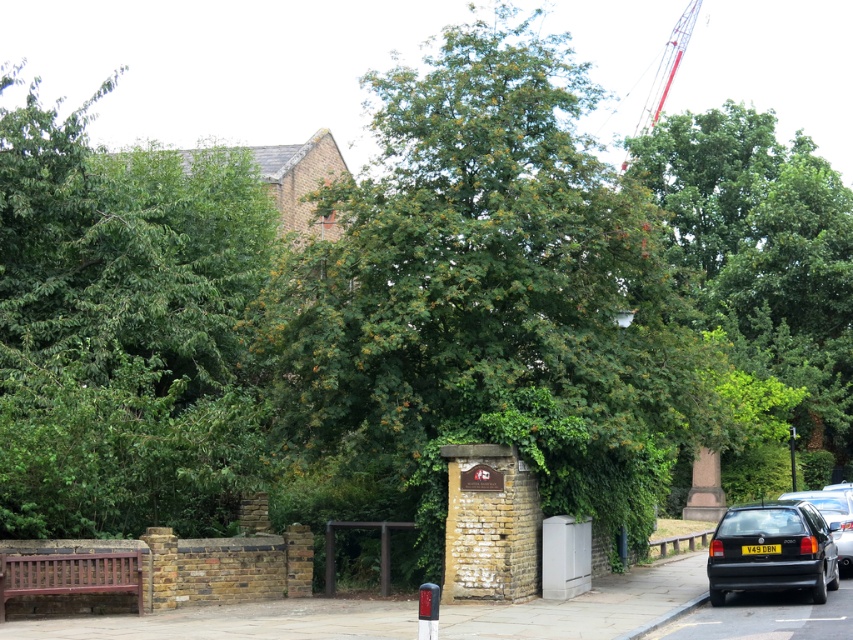
You are standing at the entrance of a park and see the matte black hatchback at lower right and the wooden bench at lower left. Which object is closer to you?

The matte black hatchback at lower right is closer to you than the wooden bench at lower left.

You are standing on the paved pathway and want to walk towards the brick wall. Which object will you encounter first, the metallic red crane at upper right or the metallic street sign at center?

You will encounter the metallic red crane at upper right first because it is closer to you than the metallic street sign at center.

Based on the photo, you are a photographer planning to capture the green leafy tree at upper right and the matte black hatchback at lower right in the same frame. Based on their sizes in the image, which object would appear bigger in your photo?

The green leafy tree at upper right would appear bigger in the photo since it has a larger size compared to the matte black hatchback at lower right according to the description.